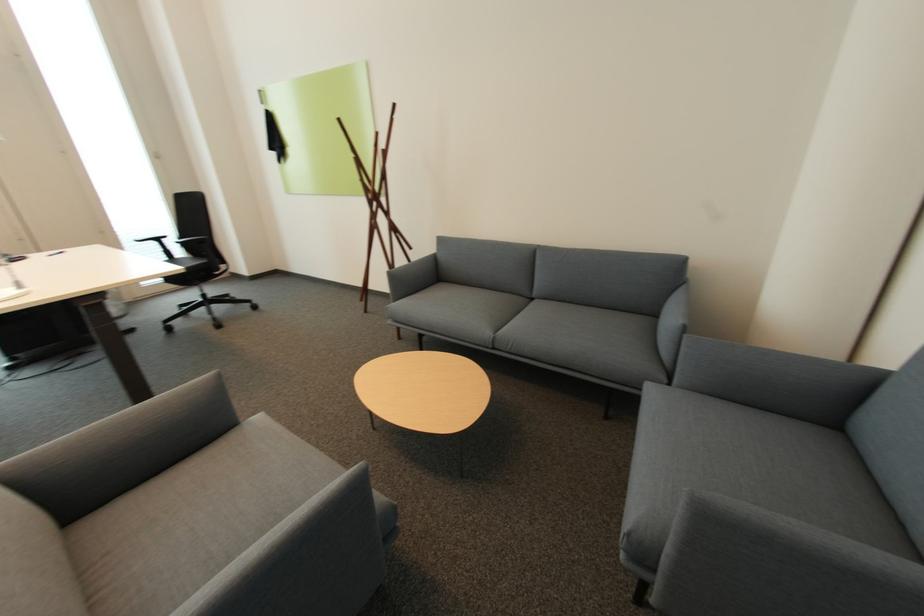
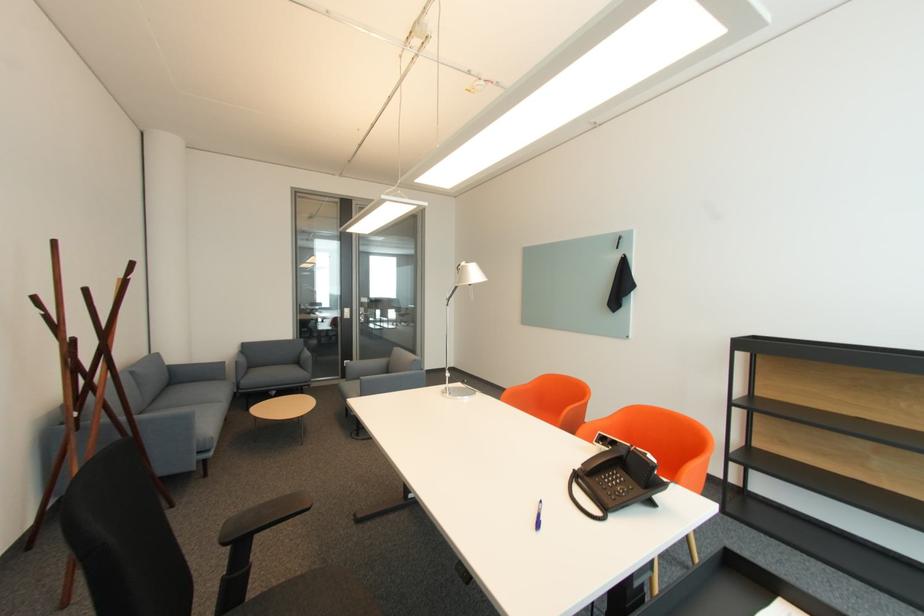
Locate, in the second image, the point that corresponds to [540,300] in the first image.

(151, 411)